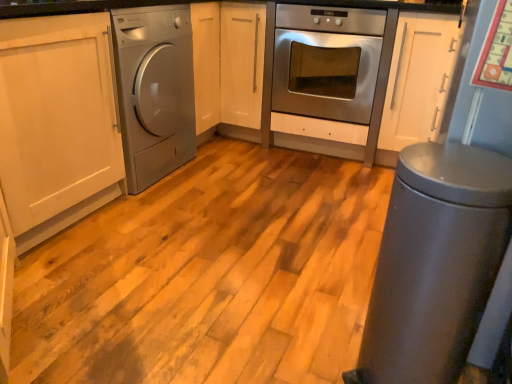
Question: Should I look upward or downward to see white matte cabinet at center?

Choices:
 (A) up
 (B) down

Answer: (A)

Question: Can you confirm if satin silver washing machine at left is smaller than stainless steel oven at center?

Choices:
 (A) no
 (B) yes

Answer: (B)

Question: Is stainless steel oven at center a part of satin silver washing machine at left?

Choices:
 (A) no
 (B) yes

Answer: (A)

Question: Is satin silver washing machine at left looking in the opposite direction of stainless steel oven at center?

Choices:
 (A) yes
 (B) no

Answer: (B)

Question: From a real-world perspective, is satin silver washing machine at left located higher than stainless steel oven at center?

Choices:
 (A) yes
 (B) no

Answer: (A)

Question: Is satin silver washing machine at left next to stainless steel oven at center and touching it?

Choices:
 (A) yes
 (B) no

Answer: (B)

Question: Could you tell me if satin silver washing machine at left is turned towards stainless steel oven at center?

Choices:
 (A) yes
 (B) no

Answer: (B)

Question: Is white matte cabinet at center next to stainless steel oven at center and touching it?

Choices:
 (A) yes
 (B) no

Answer: (B)

Question: Does white matte cabinet at center turn towards stainless steel oven at center?

Choices:
 (A) yes
 (B) no

Answer: (B)

Question: Does white matte cabinet at center have a smaller size compared to stainless steel oven at center?

Choices:
 (A) no
 (B) yes

Answer: (A)

Question: Considering the relative positions of white matte cabinet at center and stainless steel oven at center in the image provided, is white matte cabinet at center behind stainless steel oven at center?

Choices:
 (A) yes
 (B) no

Answer: (A)

Question: Does white matte cabinet at center have a larger size compared to stainless steel oven at center?

Choices:
 (A) no
 (B) yes

Answer: (B)

Question: Considering the relative sizes of white matte cabinet at center and stainless steel oven at center in the image provided, is white matte cabinet at center shorter than stainless steel oven at center?

Choices:
 (A) no
 (B) yes

Answer: (A)

Question: From the image's perspective, is metallic gray trash can at lower right on satin silver washing machine at left?

Choices:
 (A) no
 (B) yes

Answer: (A)